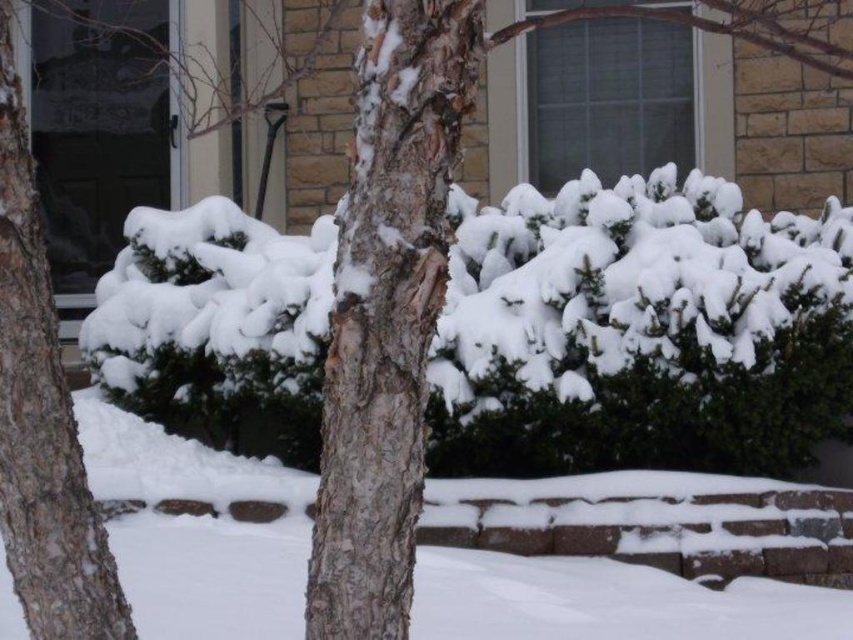
How distant is bark textured tree trunk at center from smooth bark tree trunk at left?

bark textured tree trunk at center and smooth bark tree trunk at left are 33.05 inches apart.

Does bark textured tree trunk at center have a greater height compared to smooth bark tree trunk at left?

Incorrect, bark textured tree trunk at center's height is not larger of smooth bark tree trunk at left's.

Where is `bark textured tree trunk at center`? bark textured tree trunk at center is located at coordinates (387, 310).

Identify the location of bark textured tree trunk at center. (387, 310).

Is white fluffy hedge at center taller than smooth bark tree trunk at left?

Yes.

Locate an element on the screen. Image resolution: width=853 pixels, height=640 pixels. white fluffy hedge at center is located at coordinates (640, 330).

Is point (202, 365) more distant than point (384, 598)?

Yes.

Does point (740, 420) come in front of point (328, 371)?

No.

This screenshot has width=853, height=640. Identify the location of white fluffy hedge at center. (640, 330).